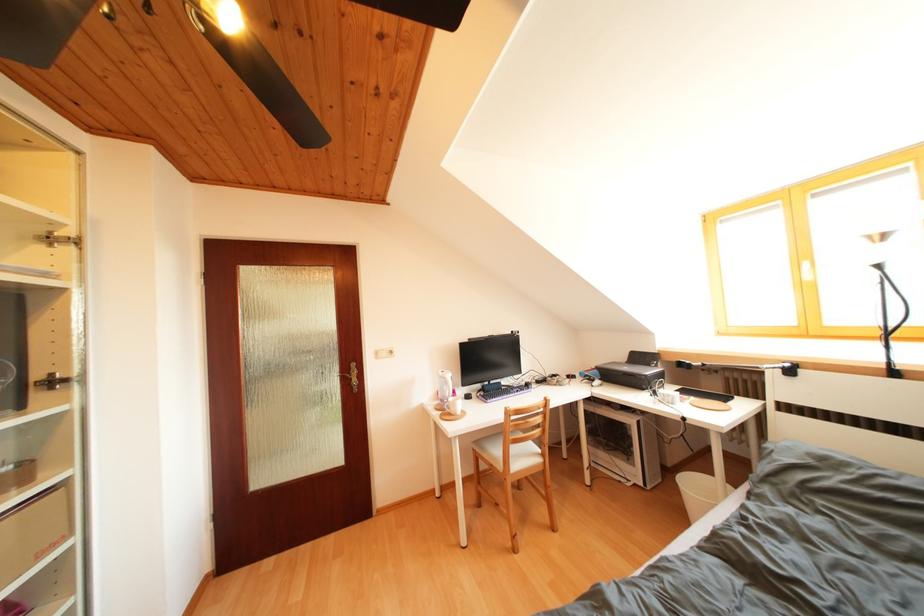
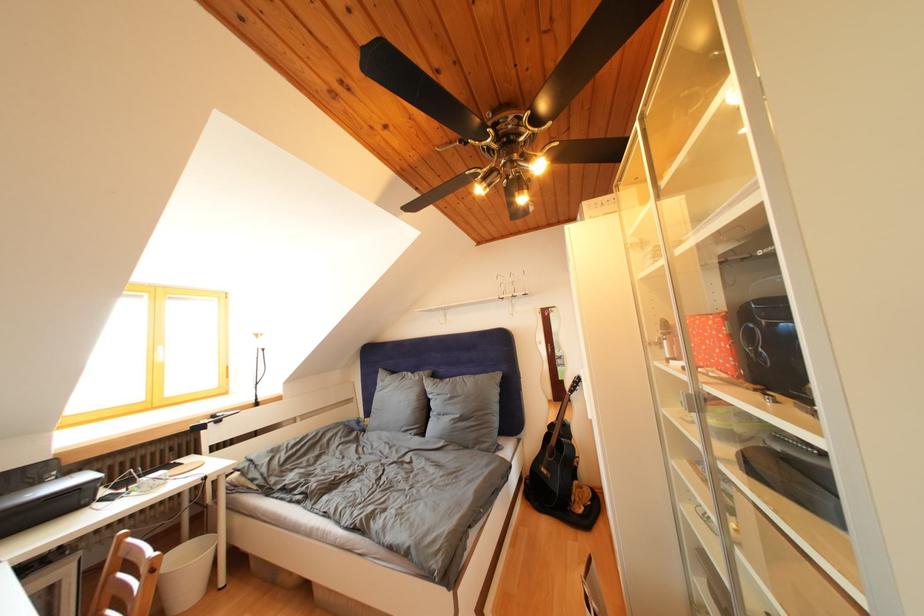
Find the pixel in the second image that matches the point at 655,370 in the first image.

(44, 488)